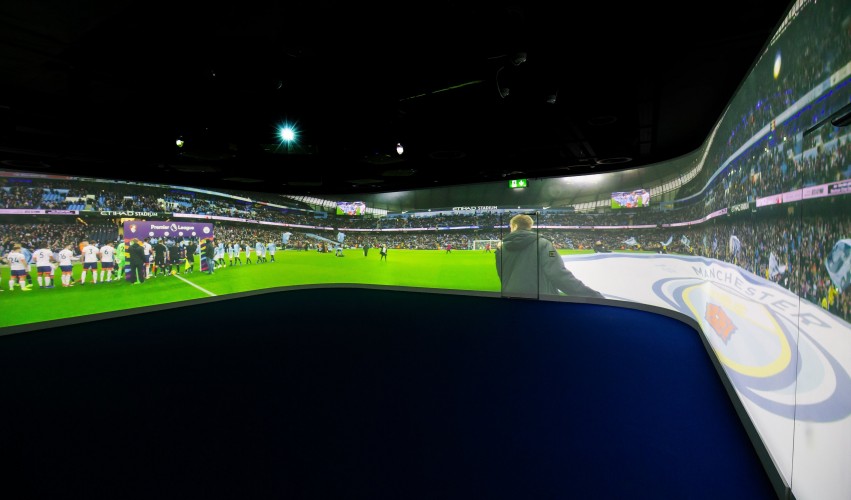
This screenshot has height=500, width=851. Identify the location of doors. (523, 247), (832, 349).